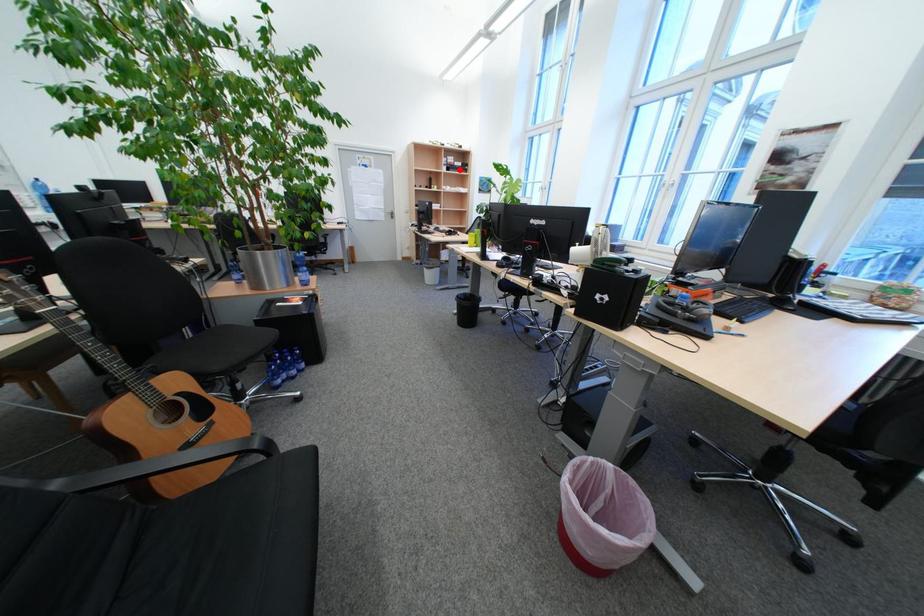
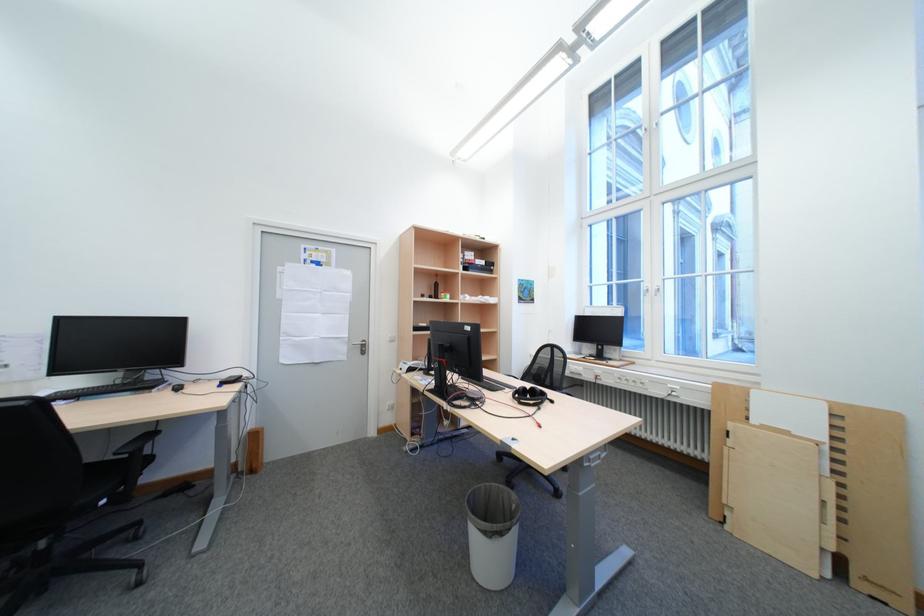
Where in the second image is the point corresponding to the highlighted location from the first image?

(477, 270)